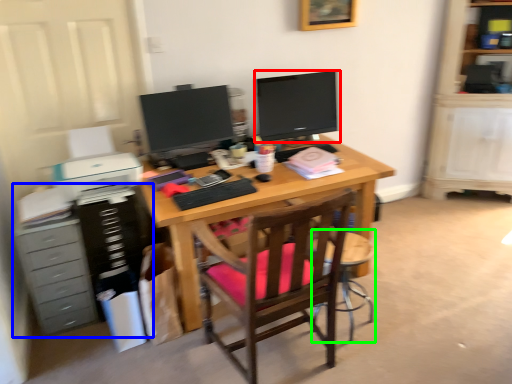
Question: Which object is the closest to the television (highlighted by a red box)? Choose among these: dresser (highlighted by a blue box) or computer chair (highlighted by a green box).

Choices:
 (A) dresser
 (B) computer chair

Answer: (B)